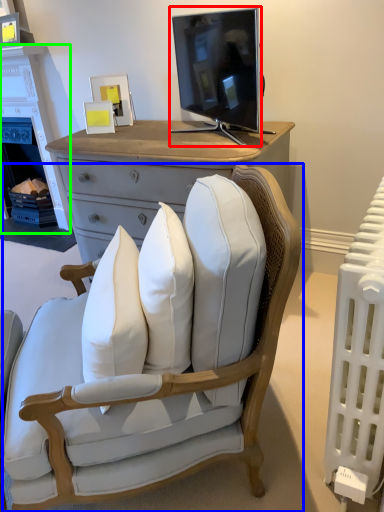
Question: Which object is the farthest from television (highlighted by a red box)? Choose among these: chair (highlighted by a blue box) or fireplace (highlighted by a green box).

Choices:
 (A) chair
 (B) fireplace

Answer: (B)